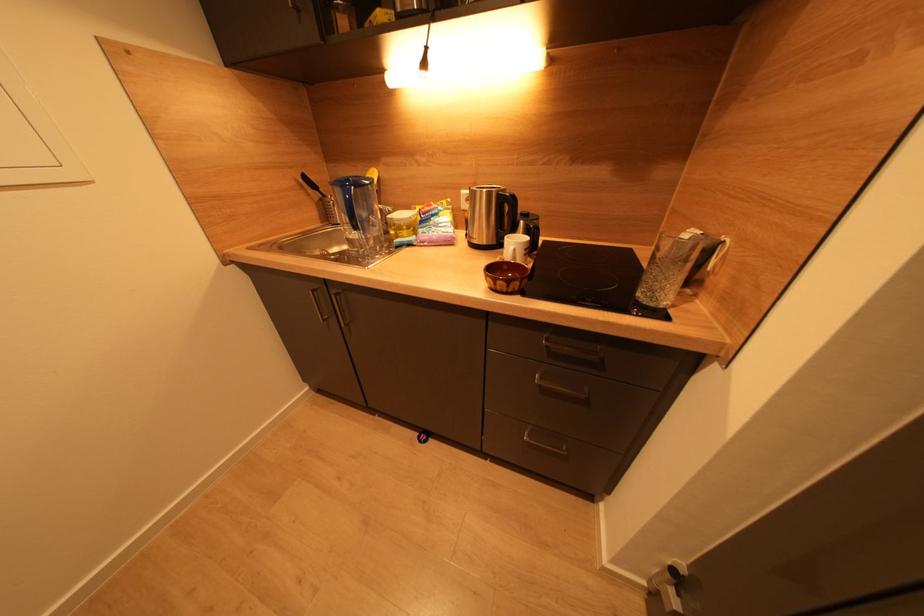
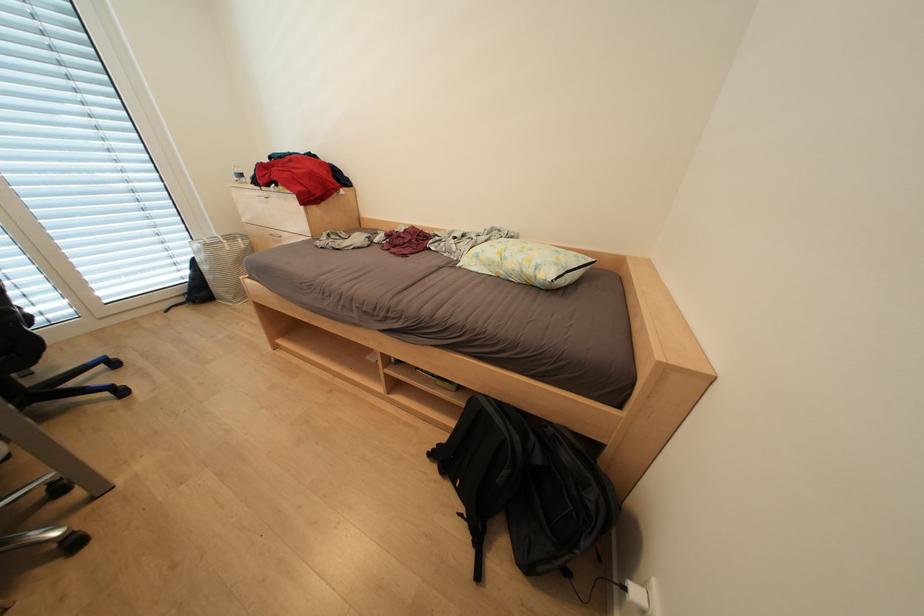
Question: In a continuous first-person perspective shot, in which direction is the camera moving?

Choices:
 (A) Left
 (B) Right
 (C) Forward
 (D) Backward

Answer: (A)